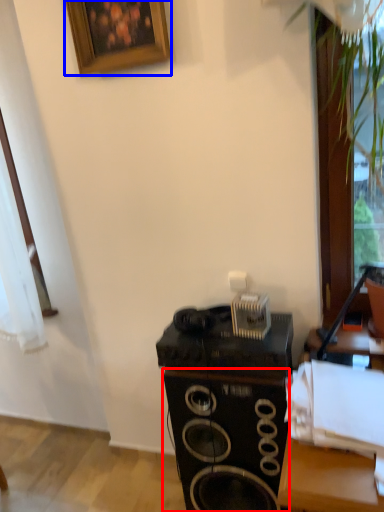
Question: Which object is further to the camera taking this photo, speaker (highlighted by a red box) or picture frame (highlighted by a blue box)?

Choices:
 (A) speaker
 (B) picture frame

Answer: (B)